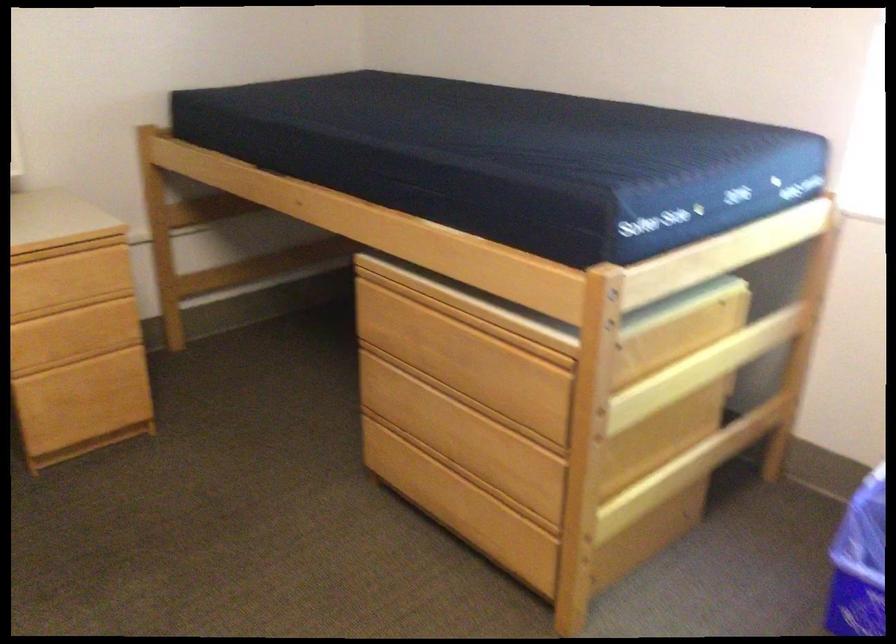
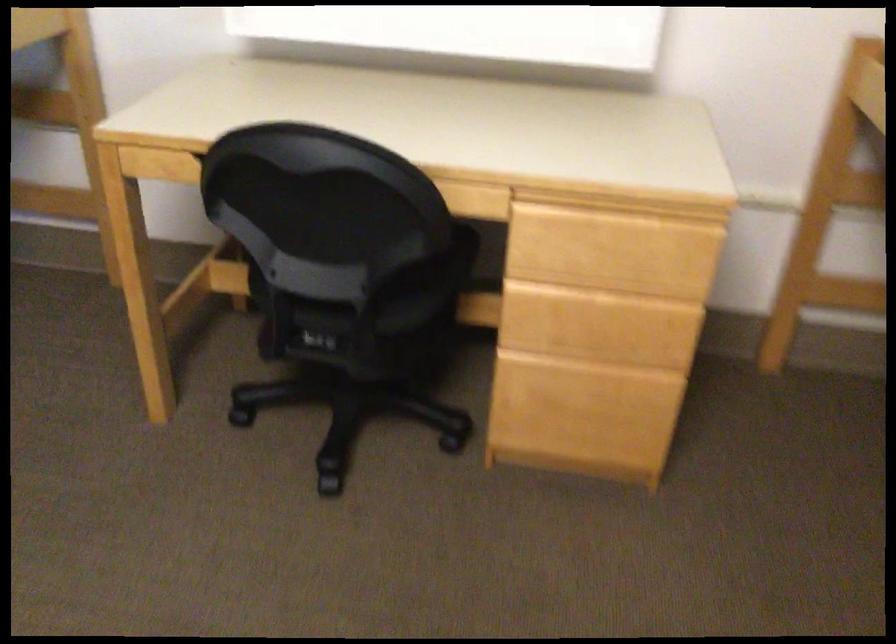
Where in the second image is the point corresponding to the point at 76,352 from the first image?

(586, 353)